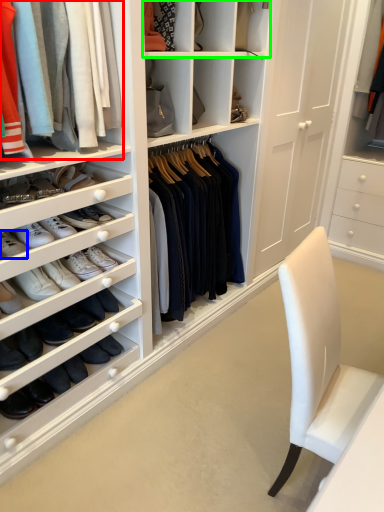
Question: Estimate the real-world distances between objects in this image. Which object is closer to clothing (highlighted by a red box), footwear (highlighted by a blue box) or shelf (highlighted by a green box)?

Choices:
 (A) footwear
 (B) shelf

Answer: (A)